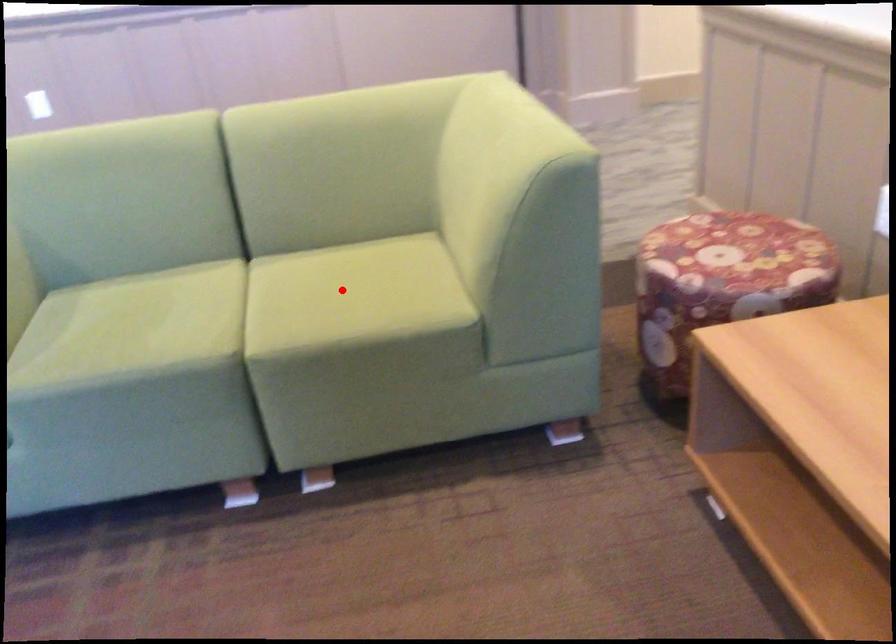
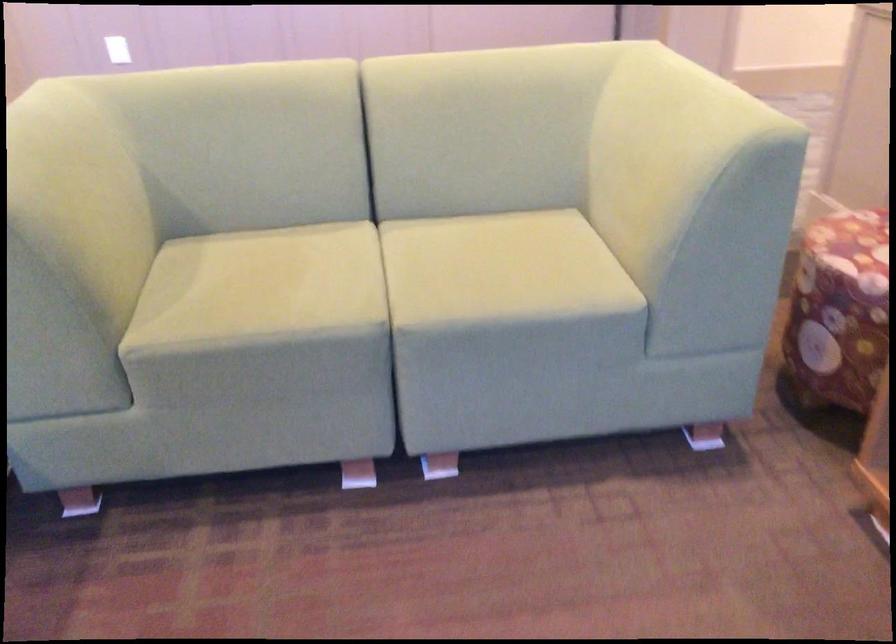
Where in the second image is the point corresponding to the highlighted location from the first image?

(488, 261)